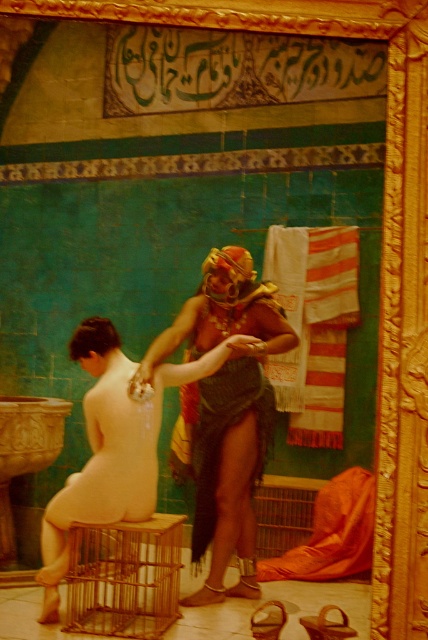
Question: Which point appears farthest from the camera in this image?

Choices:
 (A) (214, 531)
 (B) (318, 246)
 (C) (265, 392)
 (D) (178, 570)

Answer: (C)

Question: Does matte brown skin at center have a larger size compared to gold wire cage at lower left?

Choices:
 (A) yes
 (B) no

Answer: (A)

Question: Considering the real-world distances, which object is closest to the matte skin woman at center?

Choices:
 (A) gold wire cage at lower left
 (B) dark green textured cloth at center

Answer: (B)

Question: Can you confirm if matte skin woman at center is positioned below dark green textured cloth at center?

Choices:
 (A) yes
 (B) no

Answer: (B)

Question: Which point appears closest to the camera in this image?

Choices:
 (A) (92, 452)
 (B) (244, 410)

Answer: (B)

Question: Is matte skin woman at center further to the viewer compared to gold wire cage at lower left?

Choices:
 (A) no
 (B) yes

Answer: (A)